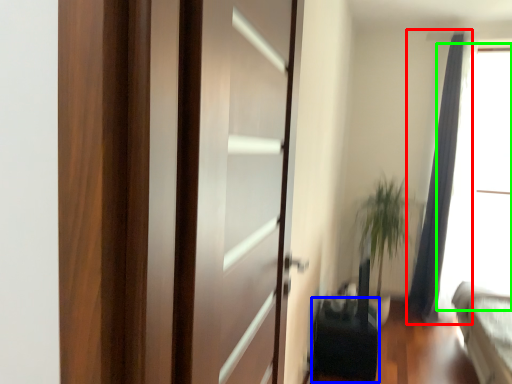
Question: Which object is the closest to the curtain (highlighted by a red box)? Choose among these: furniture (highlighted by a blue box) or window screen (highlighted by a green box).

Choices:
 (A) furniture
 (B) window screen

Answer: (B)